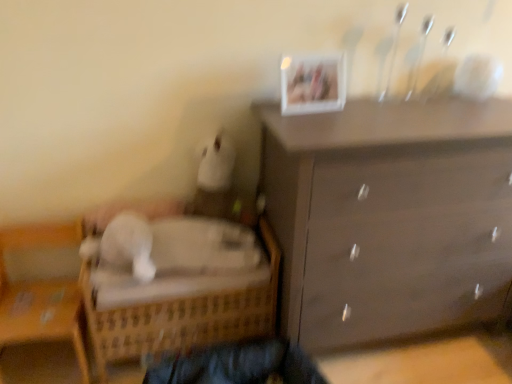
Question: Is wooden wicker basket at lower left in front of or behind white plastic picture frame at upper center in the image?

Choices:
 (A) front
 (B) behind

Answer: (A)

Question: From their relative heights in the image, would you say wooden wicker basket at lower left is taller or shorter than white plastic picture frame at upper center?

Choices:
 (A) short
 (B) tall

Answer: (B)

Question: Estimate the real-world distances between objects in this image. Which object is farther from the white plastic picture frame at upper center?

Choices:
 (A) dark blue fabric at lower center
 (B) wooden wicker basket at lower left
 (C) matte brown dresser at upper right
 (D) woven wood bed at lower left

Answer: (B)

Question: Estimate the real-world distances between objects in this image. Which object is farther from the dark blue fabric at lower center?

Choices:
 (A) woven wood bed at lower left
 (B) wooden wicker basket at lower left
 (C) white plastic picture frame at upper center
 (D) matte brown dresser at upper right

Answer: (C)